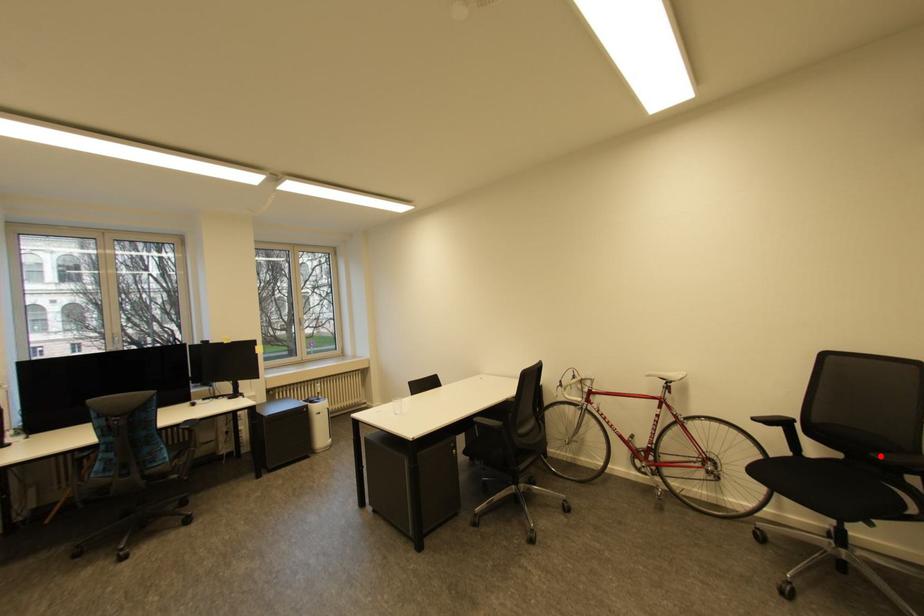
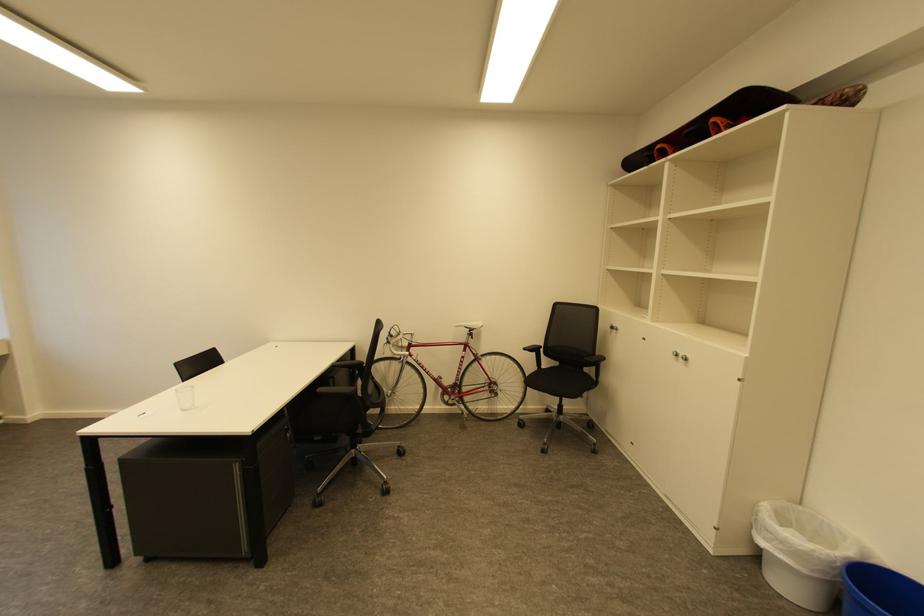
Find the pixel in the second image that matches the highlighted location in the first image.

(591, 360)